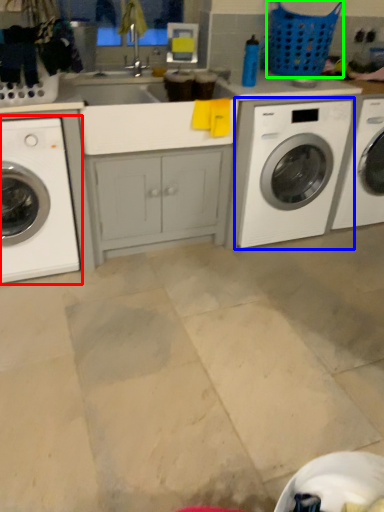
Question: Considering the real-world distances, which object is farthest from washing machine (highlighted by a red box)? washing machine (highlighted by a blue box) or basket (highlighted by a green box)?

Choices:
 (A) washing machine
 (B) basket

Answer: (B)